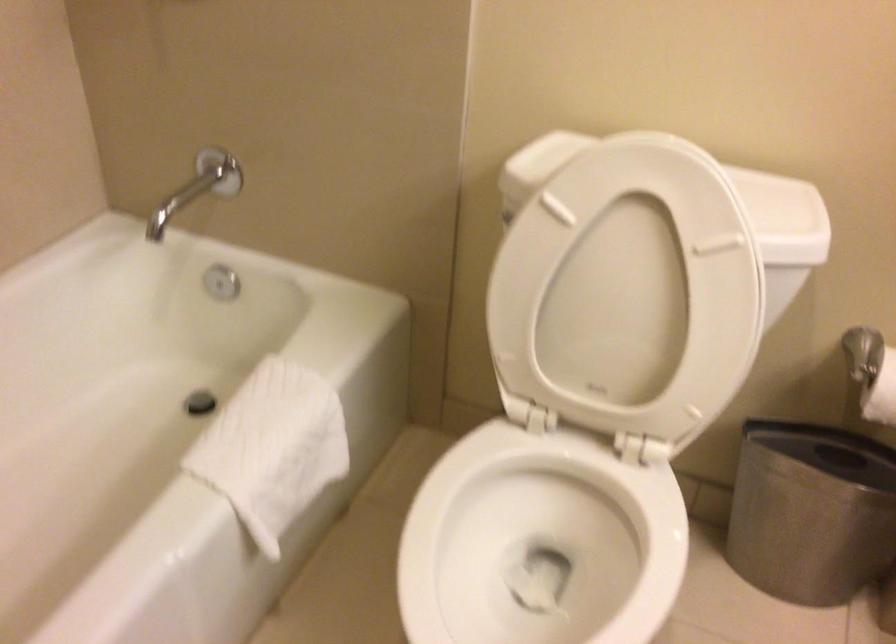
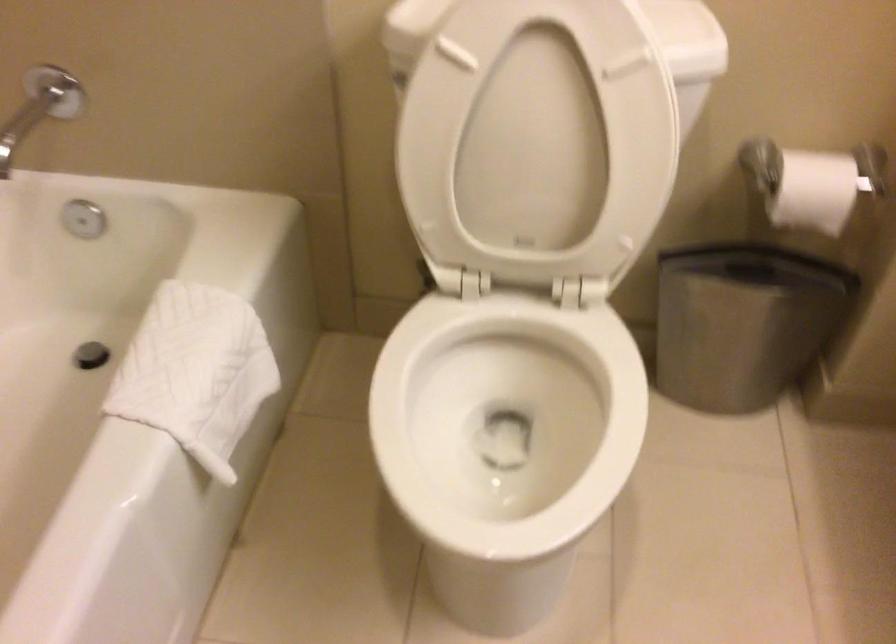
Where in the second image is the point corresponding to [550,558] from the first image?

(505, 420)